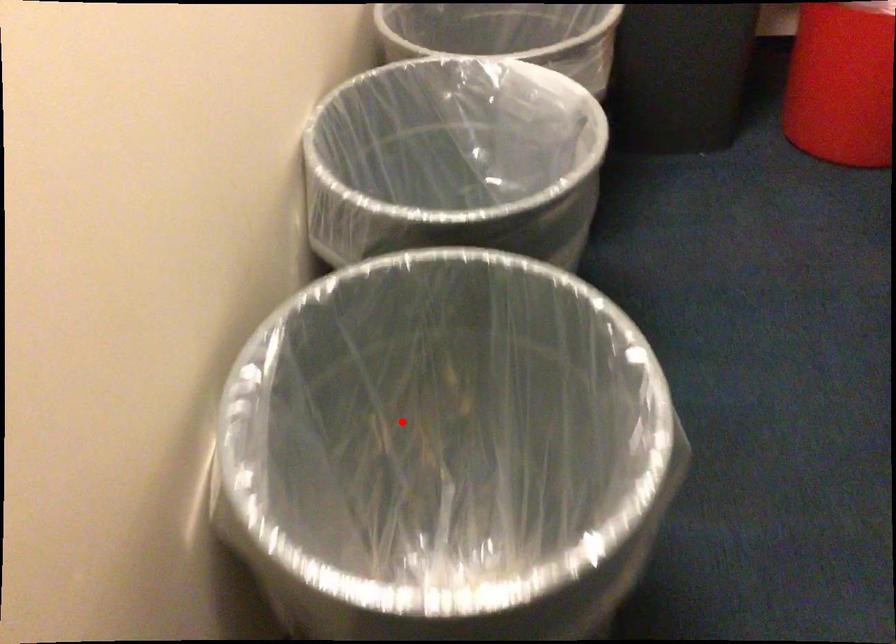
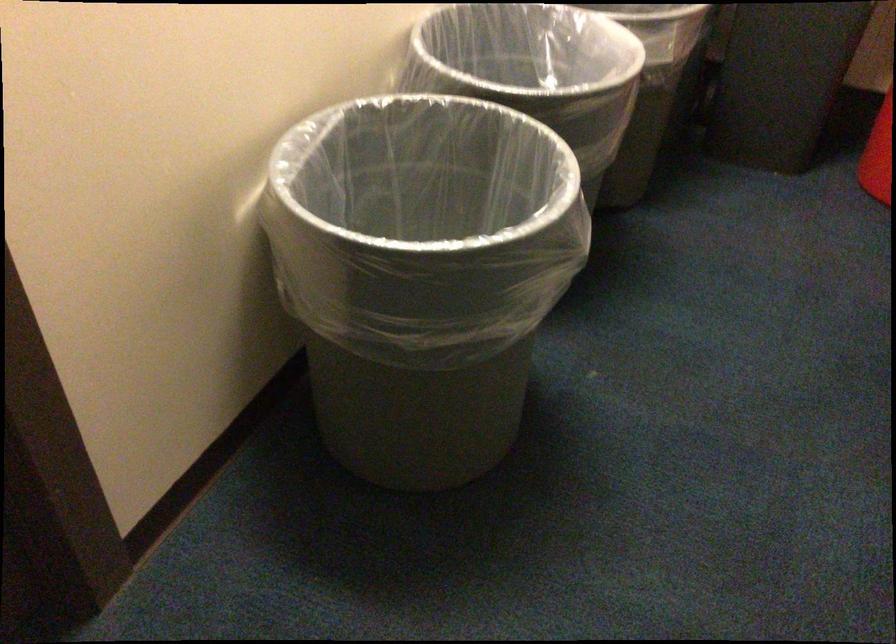
In the second image, find the point that corresponds to the highlighted location in the first image.

(410, 231)